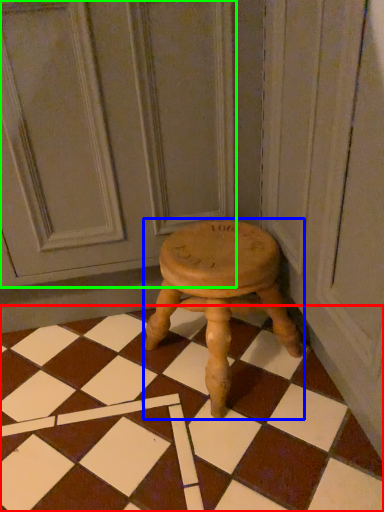
Question: Based on their relative distances, which object is nearer to square (highlighted by a red box)? Choose from stool (highlighted by a blue box) and screen door (highlighted by a green box).

Choices:
 (A) stool
 (B) screen door

Answer: (A)